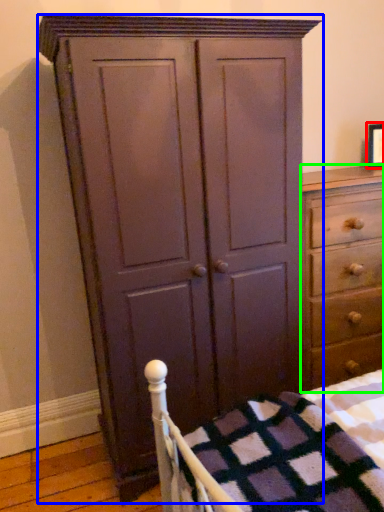
Question: Considering the real-world distances, which object is farthest from picture frame (highlighted by a red box)? cupboard (highlighted by a blue box) or chest of drawers (highlighted by a green box)?

Choices:
 (A) cupboard
 (B) chest of drawers

Answer: (A)